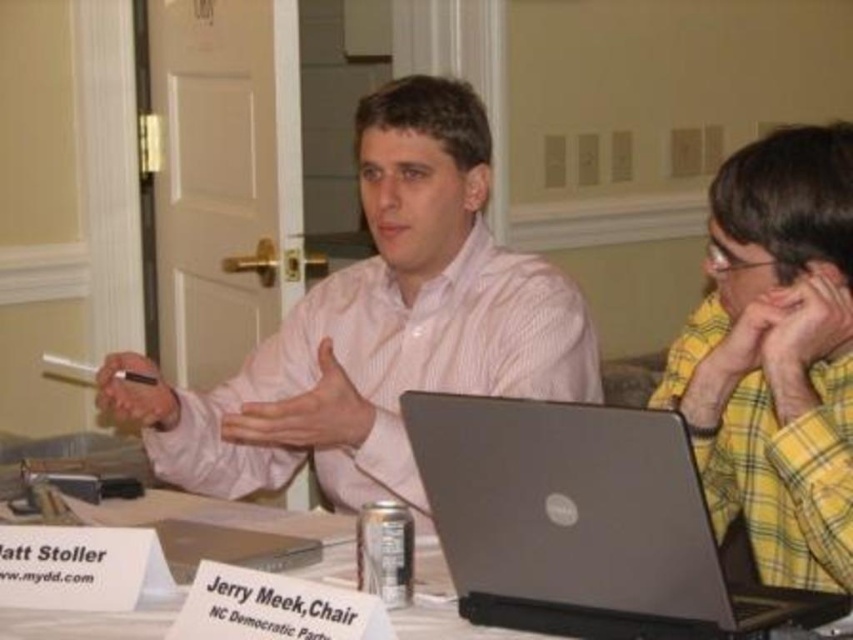
Question: Can you confirm if silver metallic laptop at center is positioned above white paper at center?

Choices:
 (A) yes
 (B) no

Answer: (A)

Question: Observing the image, what is the correct spatial positioning of pink striped shirt at center in reference to silver metallic laptop at center?

Choices:
 (A) below
 (B) above

Answer: (B)

Question: Estimate the real-world distances between objects in this image. Which object is closer to the yellow plaid shirt at right?

Choices:
 (A) white paper at center
 (B) pink striped shirt at center
 (C) silver metallic laptop at center

Answer: (C)

Question: Estimate the real-world distances between objects in this image. Which object is farther from the yellow plaid shirt at right?

Choices:
 (A) pink striped shirt at center
 (B) silver metallic laptop at center
 (C) white paper at center

Answer: (C)

Question: Estimate the real-world distances between objects in this image. Which object is farther from the pink striped shirt at center?

Choices:
 (A) silver metallic laptop at center
 (B) white paper at center
 (C) yellow plaid shirt at right

Answer: (A)

Question: Does silver metallic laptop at center have a greater width compared to yellow plaid shirt at right?

Choices:
 (A) yes
 (B) no

Answer: (A)